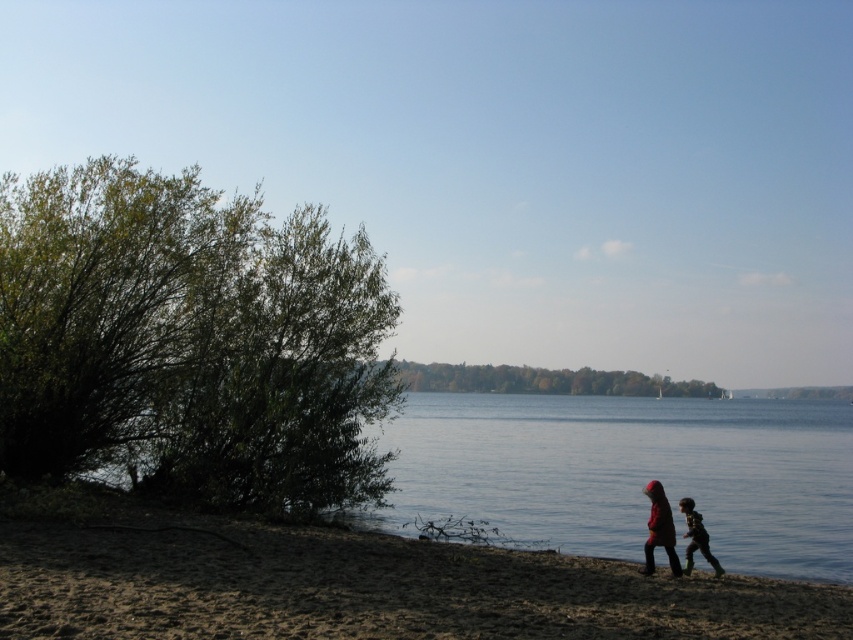
Is red woolen coat at lower right to the left of dark brown textured jacket at lower right from the viewer's perspective?

No, red woolen coat at lower right is not to the left of dark brown textured jacket at lower right.

Who is taller, red woolen coat at lower right or dark brown textured jacket at lower right?

red woolen coat at lower right

Between point (700, 550) and point (688, 572), which one is positioned in front?

Positioned in front is point (688, 572).

Where is `red woolen coat at lower right`? red woolen coat at lower right is located at coordinates (672, 532).

Who is more forward, (61, 340) or (85, 564)?

Point (85, 564) is more forward.

Where is `green leafy bush at left`? The image size is (853, 640). green leafy bush at left is located at coordinates 189,340.

Image resolution: width=853 pixels, height=640 pixels. Identify the location of green leafy bush at left. (189, 340).

You are a GUI agent. You are given a task and a screenshot of the screen. Output one action in this format:
    pyautogui.click(x=<x>, y=<y>)
    Task: Click on the red woolen coat at lower right
    The width and height of the screenshot is (853, 640).
    Given the screenshot: What is the action you would take?
    pyautogui.click(x=672, y=532)

Who is more forward, (715, 563) or (676, 572)?

Positioned in front is point (676, 572).

Where is `red woolen coat at lower right`? red woolen coat at lower right is located at coordinates tap(672, 532).

Image resolution: width=853 pixels, height=640 pixels. Find the location of `red woolen coat at lower right`. red woolen coat at lower right is located at coordinates (672, 532).